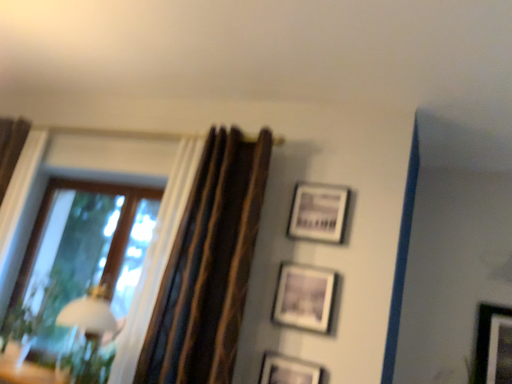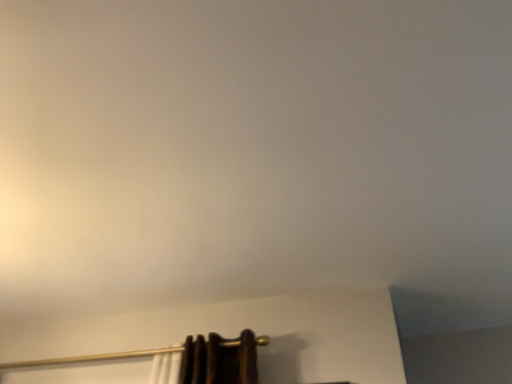
Question: How did the camera likely rotate when shooting the video?

Choices:
 (A) rotated upward
 (B) rotated downward

Answer: (A)